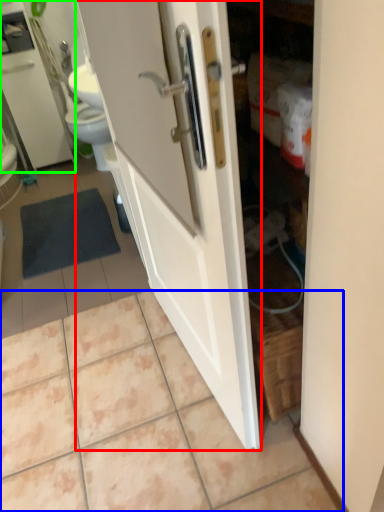
Question: Estimate the real-world distances between objects in this image. Which object is closer to door (highlighted by a red box), ceramic tile (highlighted by a blue box) or medicine cabinet (highlighted by a green box)?

Choices:
 (A) ceramic tile
 (B) medicine cabinet

Answer: (A)